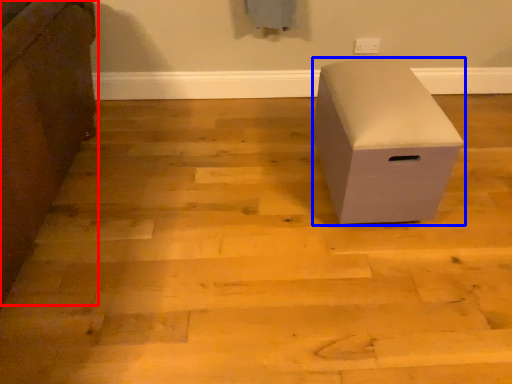
Question: Which of the following is the closest to the observer, furniture (highlighted by a red box) or furniture (highlighted by a blue box)?

Choices:
 (A) furniture
 (B) furniture

Answer: (A)